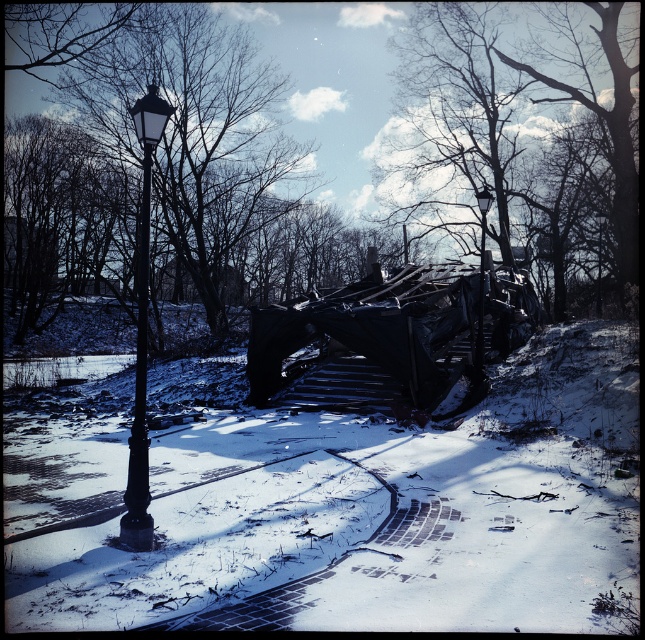
Question: Can you confirm if dark brown wood tree at upper center is thinner than black matte street light at left?

Choices:
 (A) yes
 (B) no

Answer: (B)

Question: Does dark brown wood tree at upper center appear on the right side of black matte street light at left?

Choices:
 (A) yes
 (B) no

Answer: (A)

Question: Is black matte street light at left to the left of black metal street light at upper center from the viewer's perspective?

Choices:
 (A) yes
 (B) no

Answer: (A)

Question: Among these points, which one is nearest to the camera?

Choices:
 (A) (146, 248)
 (B) (475, 346)
 (C) (457, 76)
 (D) (223, 96)

Answer: (A)

Question: Which of the following is the farthest from the observer?

Choices:
 (A) black metal street light at upper center
 (B) smooth black lamp post at left
 (C) black matte street light at left
 (D) dark brown wood tree at upper center

Answer: (D)

Question: Among these points, which one is nearest to the camera?

Choices:
 (A) (482, 323)
 (B) (146, 109)
 (C) (613, 100)

Answer: (B)